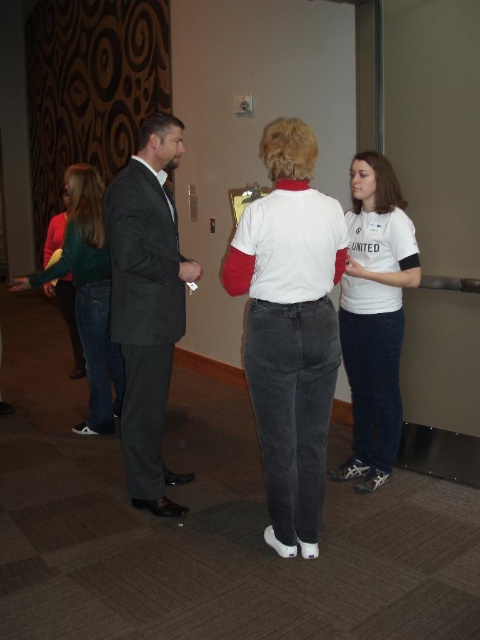
Question: Which point appears closest to the camera in this image?

Choices:
 (A) [384, 193]
 (B) [311, 177]
 (C) [159, 115]

Answer: (B)

Question: Which point is farther to the camera?

Choices:
 (A) (303, 179)
 (B) (397, 205)

Answer: (B)

Question: Can you confirm if white cotton shirt at center is wider than white matte shirt at right?

Choices:
 (A) no
 (B) yes

Answer: (B)

Question: Is white matte shirt at right smaller than blonde hair wig at left?

Choices:
 (A) no
 (B) yes

Answer: (A)

Question: Can you confirm if white cotton shirt at center is positioned to the right of brown matte wig at upper right?

Choices:
 (A) no
 (B) yes

Answer: (A)

Question: Which object appears farthest from the camera in this image?

Choices:
 (A) brown matte wig at upper right
 (B) blonde synthetic wig at center

Answer: (A)